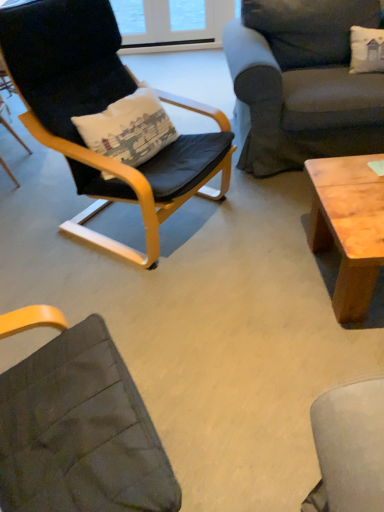
I want to click on vacant area situated to the left side of black leather chair at left, which is the second chair from left to right, so click(x=38, y=221).